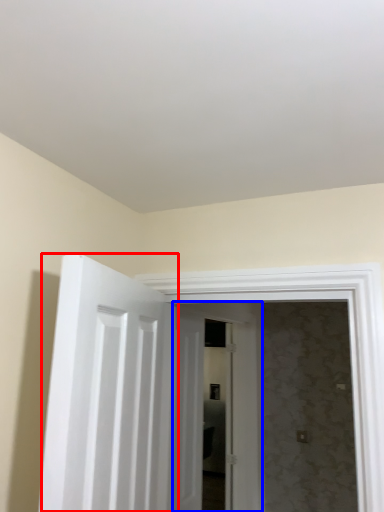
Question: Which object is further to the camera taking this photo, door (highlighted by a red box) or door (highlighted by a blue box)?

Choices:
 (A) door
 (B) door

Answer: (B)